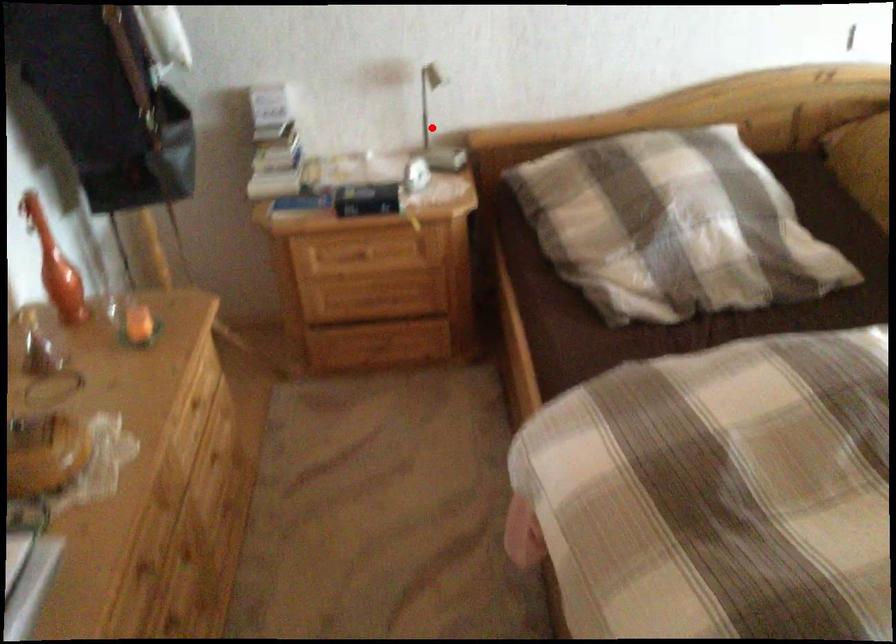
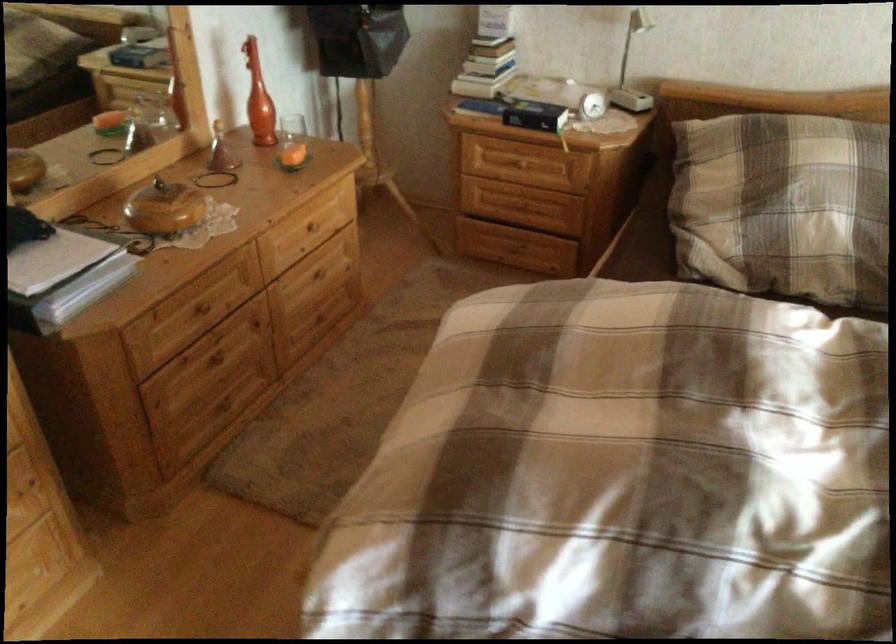
The point at the highlighted location is marked in the first image. Where is the corresponding point in the second image?

(632, 67)